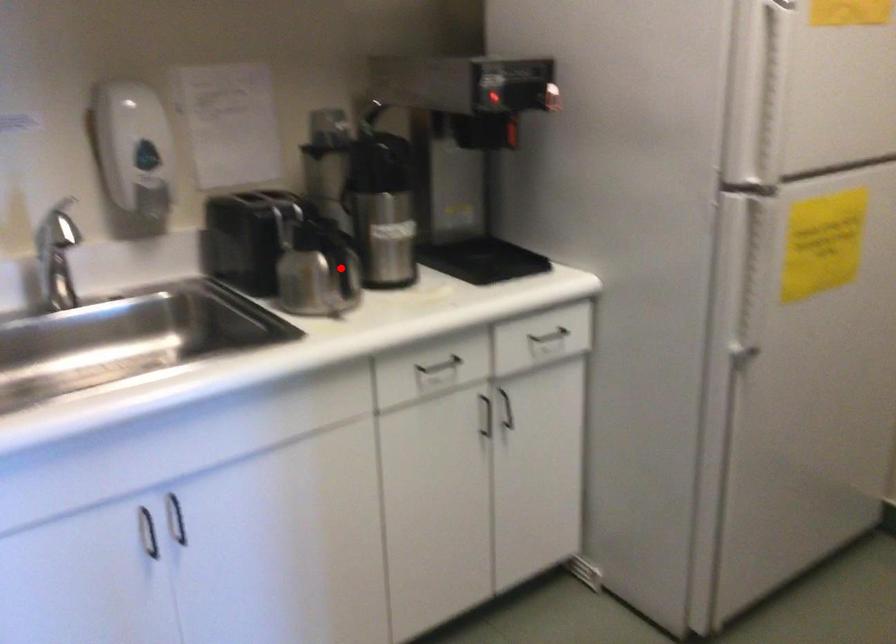
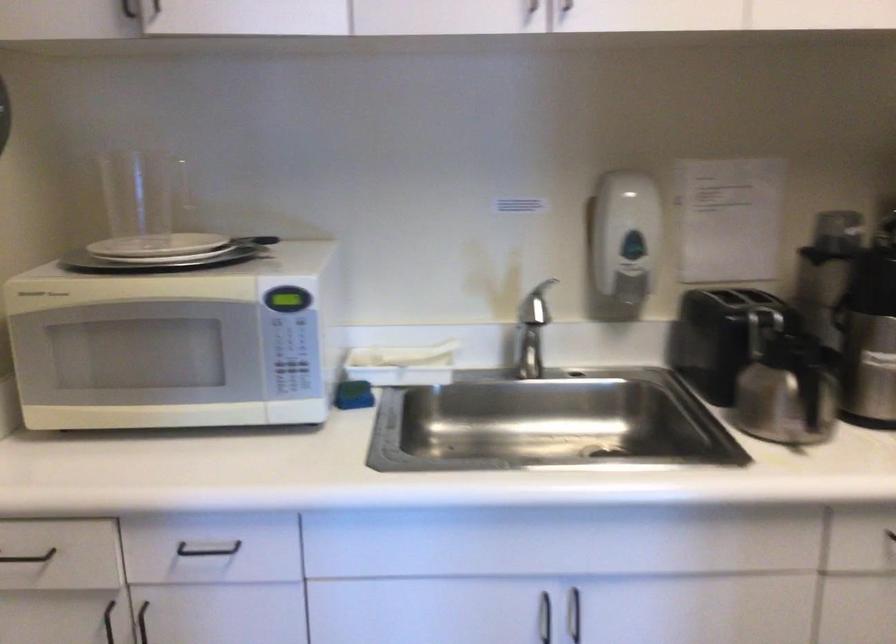
Where in the second image is the point corresponding to the highlighted location from the first image?

(810, 395)